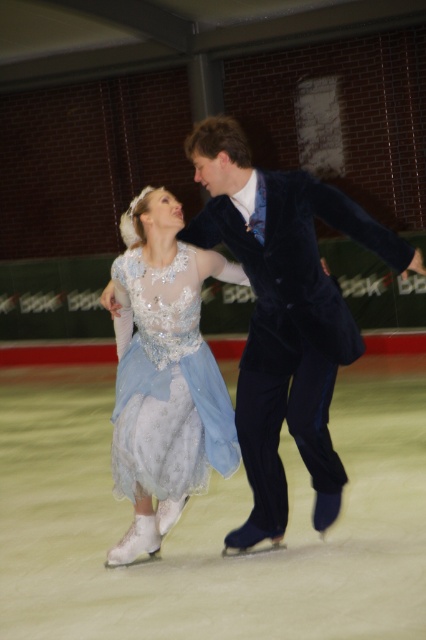
Is light blue satin dress at center positioned before satin blue dress at center?

Yes.

Does light blue satin dress at center have a greater height compared to satin blue dress at center?

Yes, light blue satin dress at center is taller than satin blue dress at center.

Image resolution: width=426 pixels, height=640 pixels. In order to click on light blue satin dress at center in this screenshot , I will do `click(284, 314)`.

You are a GUI agent. You are given a task and a screenshot of the screen. Output one action in this format:
    pyautogui.click(x=<x>, y=<y>)
    Task: Click on the light blue satin dress at center
    
    Given the screenshot: What is the action you would take?
    pyautogui.click(x=284, y=314)

Is shiny white skates at center bigger than satin blue dress at center?

Incorrect, shiny white skates at center is not larger than satin blue dress at center.

How distant is shiny white skates at center from satin blue dress at center?

shiny white skates at center is 1.16 meters away from satin blue dress at center.

Identify the location of shiny white skates at center. (210, 522).

This screenshot has height=640, width=426. Find the location of `shiny white skates at center`. shiny white skates at center is located at coordinates (210, 522).

Can you confirm if shiny white skates at center is bigger than light blue satin dress at center?

Actually, shiny white skates at center might be smaller than light blue satin dress at center.

Which of these two, shiny white skates at center or light blue satin dress at center, stands taller?

Standing taller between the two is light blue satin dress at center.

Describe the element at coordinates (210, 522) in the screenshot. The height and width of the screenshot is (640, 426). I see `shiny white skates at center` at that location.

Identify the location of shiny white skates at center. This screenshot has width=426, height=640. (210, 522).